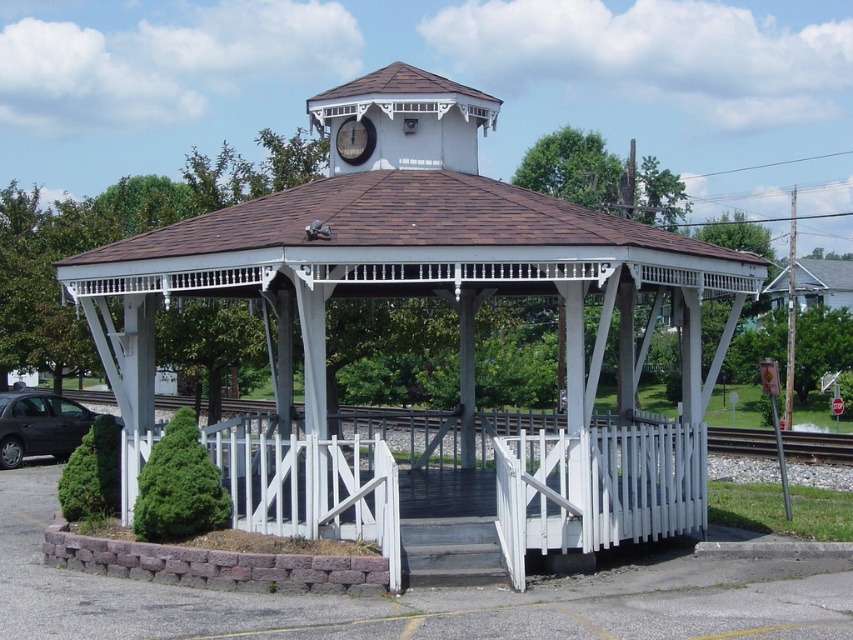
Is white wood gazebo at center shorter than white wood clock at upper center?

In fact, white wood gazebo at center may be taller than white wood clock at upper center.

This screenshot has height=640, width=853. What do you see at coordinates (422, 294) in the screenshot? I see `white wood gazebo at center` at bounding box center [422, 294].

You are a GUI agent. You are given a task and a screenshot of the screen. Output one action in this format:
    pyautogui.click(x=<x>, y=<y>)
    Task: Click on the white wood gazebo at center
    This screenshot has height=640, width=853.
    Given the screenshot: What is the action you would take?
    pyautogui.click(x=422, y=294)

Looking at this image, is the position of white wood gazebo at center less distant than that of matte black car at lower left?

That is True.

Is white wood gazebo at center to the right of matte black car at lower left from the viewer's perspective?

Indeed, white wood gazebo at center is positioned on the right side of matte black car at lower left.

Does point (267, 516) come in front of point (9, 456)?

Yes, point (267, 516) is closer to viewer.

At what (x,y) coordinates should I click in order to perform the action: click on white wood gazebo at center. Please return your answer as a coordinate pair (x, y). Looking at the image, I should click on (422, 294).

Is white wooden train track at lower center above white wood clock at upper center?

No.

The image size is (853, 640). Describe the element at coordinates (405, 433) in the screenshot. I see `white wooden train track at lower center` at that location.

What do you see at coordinates (405, 433) in the screenshot?
I see `white wooden train track at lower center` at bounding box center [405, 433].

This screenshot has height=640, width=853. What are the coordinates of `white wooden train track at lower center` in the screenshot? It's located at (405, 433).